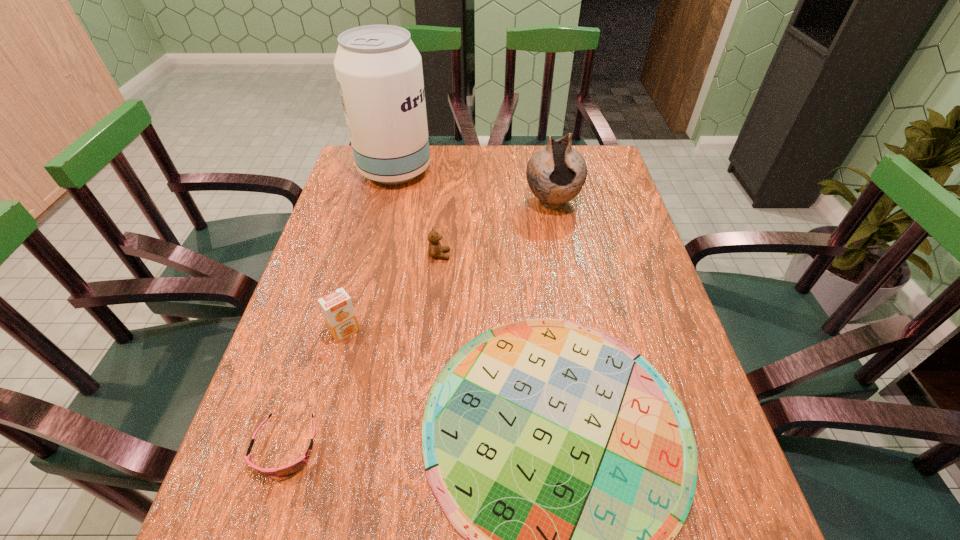
At what (x,y) coordinates should I click in order to perform the action: click on object that is at the far edge. Please return your answer as a coordinate pair (x, y). This screenshot has width=960, height=540. Looking at the image, I should click on (379, 72).

Find the location of a particular element. alcohol located at the left edge is located at coordinates click(x=379, y=72).

Where is `orange juice that is positioned at the left edge`? orange juice that is positioned at the left edge is located at coordinates (337, 308).

Find the location of a particular element. goggles that is positioned at the left edge is located at coordinates (292, 468).

At what (x,y) coordinates should I click in order to perform the action: click on object that is at the right edge. Please return your answer as a coordinate pair (x, y). The image size is (960, 540). Looking at the image, I should click on (556, 173).

The height and width of the screenshot is (540, 960). Identify the location of object that is at the far left corner. (379, 72).

The image size is (960, 540). In the image, there is a desktop. Identify the location of free region at the far edge. point(442,167).

What are the coordinates of `free space at the left edge` in the screenshot? It's located at (372, 251).

The height and width of the screenshot is (540, 960). In the image, there is a desktop. In order to click on vacant space at the right edge in this screenshot , I will do `click(623, 212)`.

Image resolution: width=960 pixels, height=540 pixels. In the image, there is a desktop. What are the coordinates of `vacant space at the far right corner` in the screenshot? It's located at (589, 163).